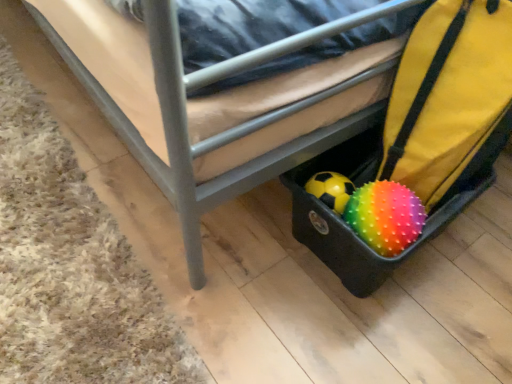
Where is `vacant area that is in front of rubberized black suitcase at lower right`? vacant area that is in front of rubberized black suitcase at lower right is located at coordinates (368, 332).